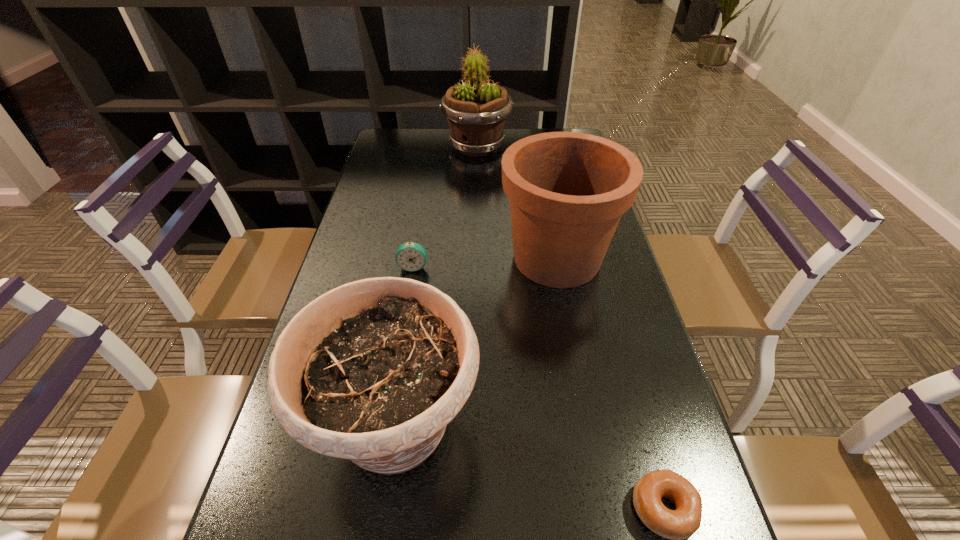
Locate an element on the screen. This screenshot has width=960, height=540. the farthest flowerpot is located at coordinates (476, 111).

The width and height of the screenshot is (960, 540). Identify the location of the second nearest flowerpot. (567, 191).

Locate an element on the screen. the nearest flowerpot is located at coordinates (372, 371).

The height and width of the screenshot is (540, 960). Identify the location of alarm clock. (410, 256).

Locate an element on the screen. This screenshot has height=540, width=960. free region located 0.400m on the front of the farthest flowerpot is located at coordinates (476, 235).

Identify the location of vacant space situated on the left of the second nearest flowerpot. The image size is (960, 540). (445, 259).

This screenshot has height=540, width=960. In order to click on vacant region located 0.160m on the right of the nearest flowerpot in this screenshot , I will do pos(565,429).

I want to click on vacant space located on the front-facing side of the alarm clock, so click(389, 417).

This screenshot has width=960, height=540. I want to click on object that is positioned at the far edge, so click(x=476, y=111).

Identify the location of flowerpot that is at the left edge. The height and width of the screenshot is (540, 960). (372, 371).